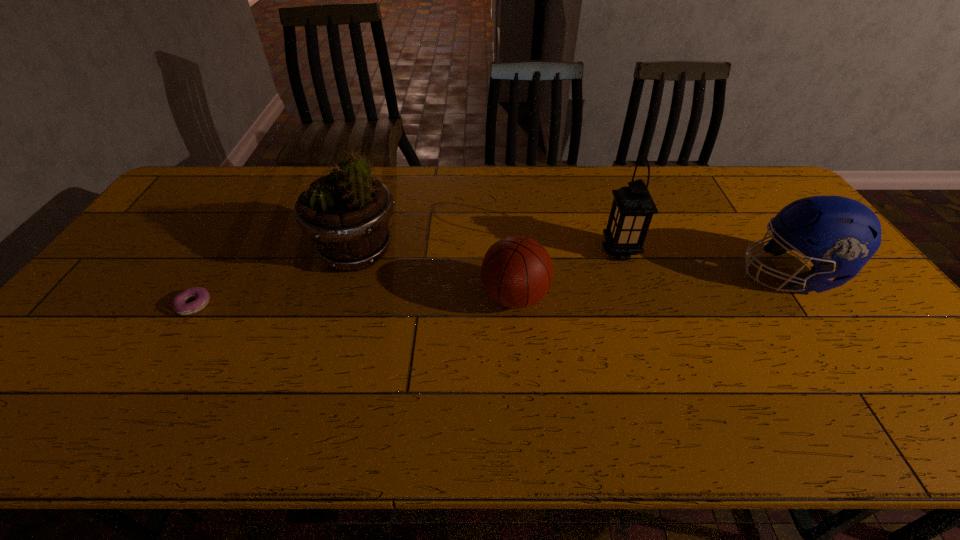
The width and height of the screenshot is (960, 540). Find the location of `vacant space situated on the back of the lantern`. vacant space situated on the back of the lantern is located at coordinates (593, 172).

Locate an element on the screen. The height and width of the screenshot is (540, 960). free location located on the front-facing side of the third tallest object is located at coordinates (603, 274).

Identify the location of free space located on the front-facing side of the third tallest object. (660, 274).

At what (x,y) coordinates should I click in order to perform the action: click on free space located on the front-facing side of the third tallest object. Please return your answer as a coordinate pair (x, y). The image size is (960, 540). Looking at the image, I should click on (699, 274).

Locate an element on the screen. vacant area located 0.080m on the right of the third object from right to left is located at coordinates (579, 297).

Find the location of a particular element. This screenshot has height=540, width=960. vacant space located on the left of the leftmost object is located at coordinates (86, 305).

The width and height of the screenshot is (960, 540). I want to click on object that is at the right edge, so click(839, 235).

In the image, there is a desktop. What are the coordinates of `free region at the far edge` in the screenshot? It's located at (482, 199).

This screenshot has height=540, width=960. In order to click on blank space at the near edge of the desktop in this screenshot , I will do `click(118, 401)`.

Identify the location of vacant space at the left edge of the desktop. Image resolution: width=960 pixels, height=540 pixels. (113, 292).